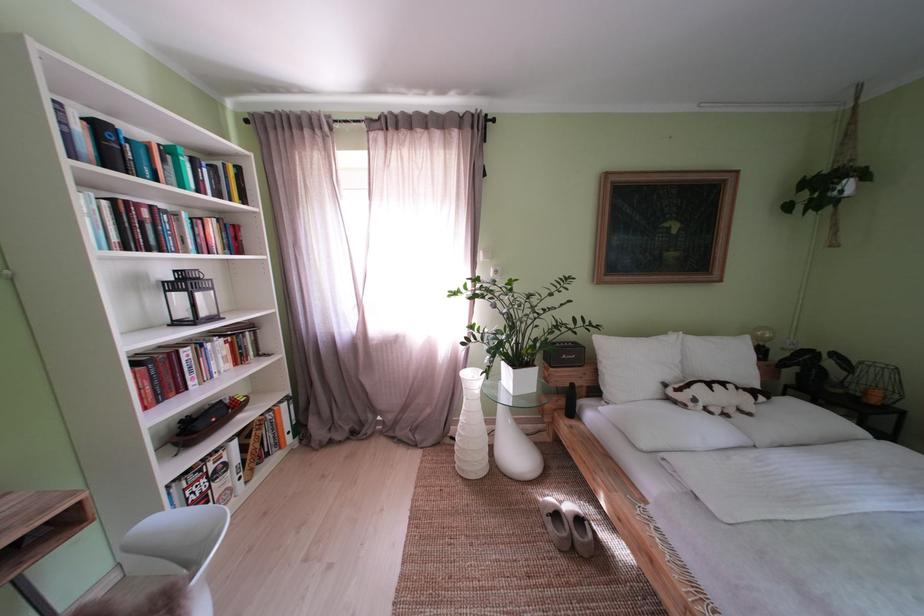
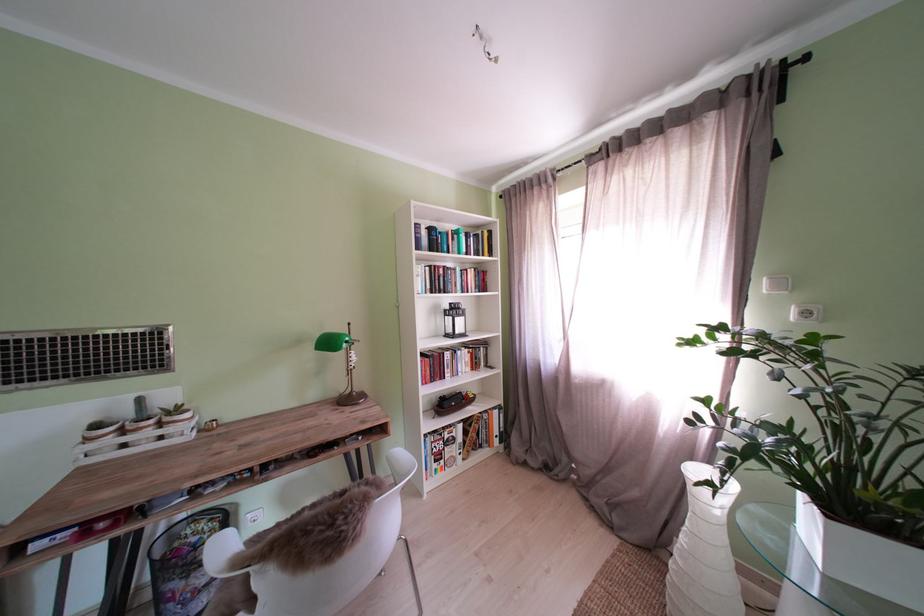
Where in the second image is the point corresponding to (247,464) from the first image?

(470, 444)